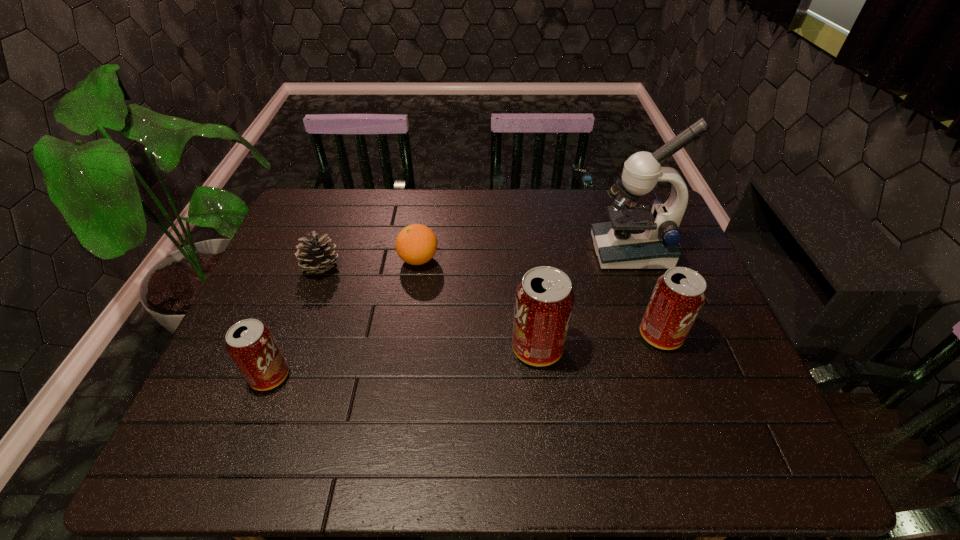
The width and height of the screenshot is (960, 540). I want to click on empty location between the fourth object from left to right and the tallest object, so click(x=584, y=300).

At what (x,y) coordinates should I click in order to perform the action: click on vacant space that's between the fourth object from right to left and the pinecone. Please return your answer as a coordinate pair (x, y). The image size is (960, 540). Looking at the image, I should click on (371, 264).

Find the location of a particular element. This screenshot has height=540, width=960. vacant region between the third object from right to left and the pinecone is located at coordinates (429, 308).

Locate an element on the screen. This screenshot has width=960, height=540. vacant area that lies between the third object from right to left and the pinecone is located at coordinates (429, 308).

I want to click on free space between the pinecone and the orange, so click(371, 264).

Find the location of a particular element. free space that is in between the tallest object and the orange is located at coordinates (525, 255).

At what (x,y) coordinates should I click in order to perform the action: click on empty space between the orange and the second soda can from left to right. Please return your answer as a coordinate pair (x, y). The height and width of the screenshot is (540, 960). Looking at the image, I should click on (478, 303).

The height and width of the screenshot is (540, 960). Find the location of `free point between the shortest soda can and the fourth shortest object`. free point between the shortest soda can and the fourth shortest object is located at coordinates (466, 355).

Image resolution: width=960 pixels, height=540 pixels. Identify the location of object that is the fifth closest to the fourth object from right to left. (678, 296).

Identify which object is located as the third nearest to the shortest soda can. Please provide its 2D coordinates. Your answer should be formatted as a tuple, i.e. [(x, y)], where the tuple contains the x and y coordinates of a point satisfying the conditions above.

[(544, 300)]